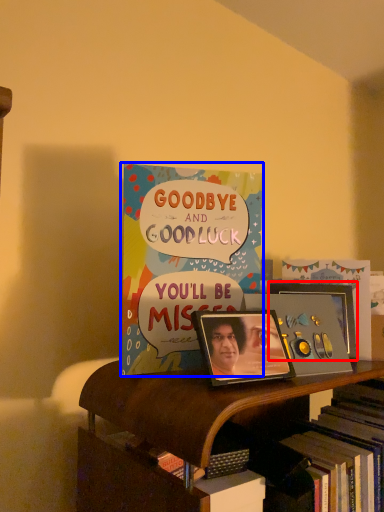
Question: Among these objects, which one is nearest to the camera, picture frame (highlighted by a red box) or book (highlighted by a blue box)?

Choices:
 (A) picture frame
 (B) book

Answer: (B)